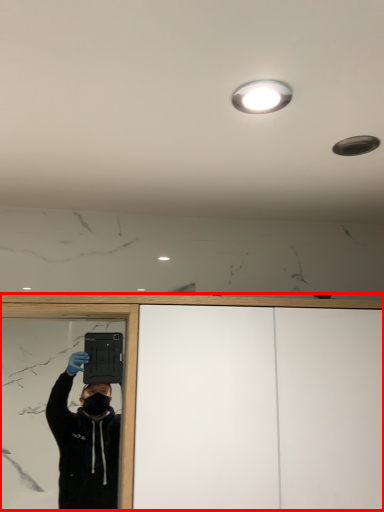
Question: Where is dresser (annotated by the red box) located in relation to droplight in the image?

Choices:
 (A) left
 (B) right

Answer: (B)